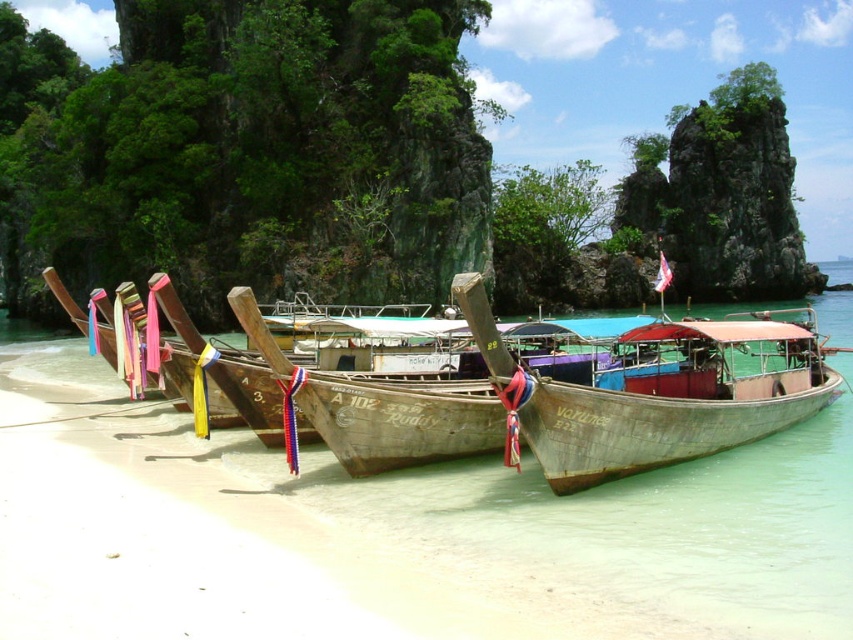
Based on the photo, who is more distant from viewer, [200,384] or [618,445]?

Point [200,384]

Between wooden longboat at center and wooden boat at center, which one appears on the left side from the viewer's perspective?

Positioned to the left is wooden longboat at center.

Locate an element on the screen. This screenshot has height=640, width=853. wooden longboat at center is located at coordinates (670, 406).